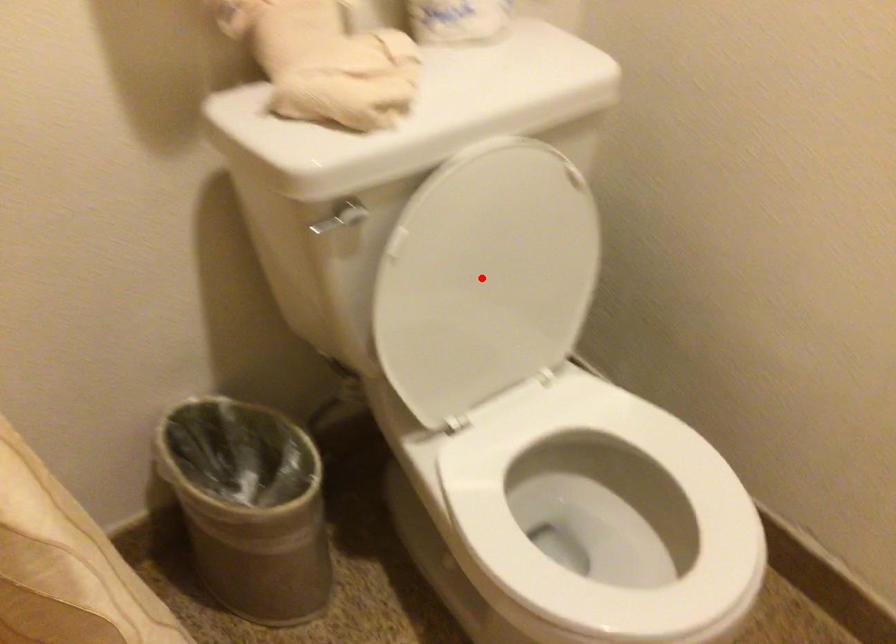
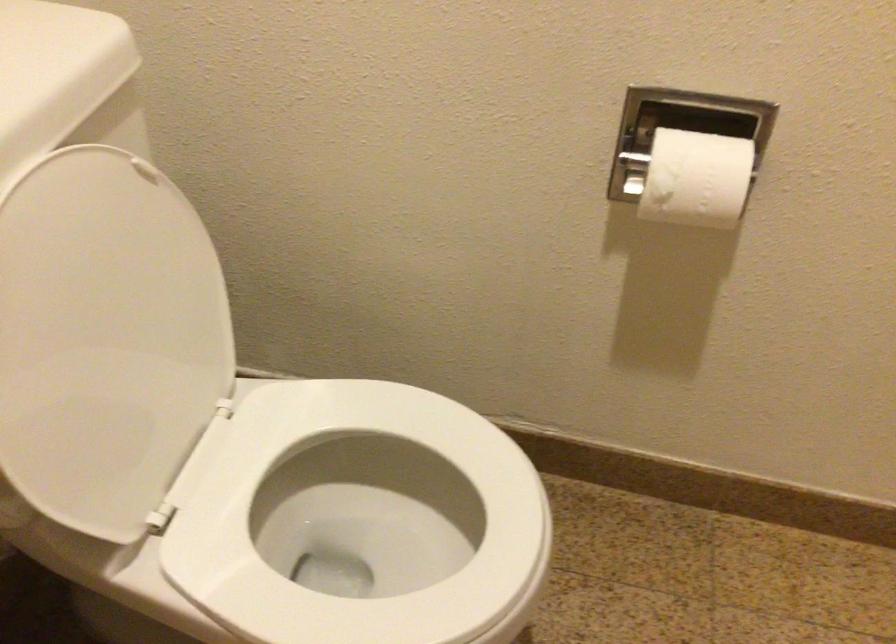
Question: I am providing you with two images of the same scene from different viewpoints. Given a red point in image1, look at the same physical point in image2. Is it:

Choices:
 (A) Closer to the viewpoint
 (B) Farther from the viewpoint

Answer: (A)